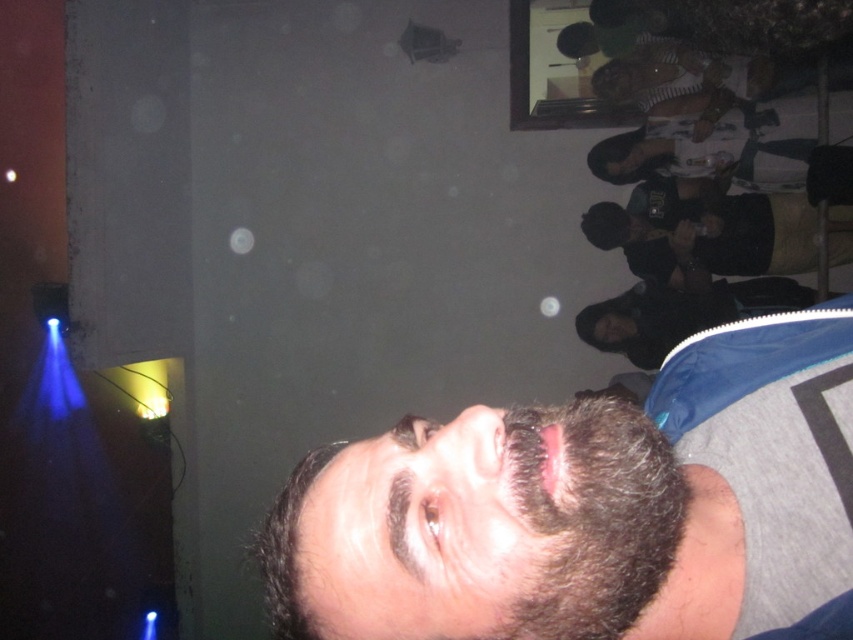
Does dark brown hair at center appear under black matte jacket at right?

Indeed, dark brown hair at center is positioned under black matte jacket at right.

Does dark brown hair at center have a larger size compared to black matte jacket at right?

No, dark brown hair at center is not bigger than black matte jacket at right.

Which is in front, point (677, 454) or point (630, 344)?

Positioned in front is point (677, 454).

Find the location of a particular element. This screenshot has width=853, height=640. dark brown hair at center is located at coordinates (589, 508).

Can you confirm if dark brown hair at center is positioned below dark blue shirt at right?

Indeed, dark brown hair at center is positioned under dark blue shirt at right.

Between point (390, 529) and point (759, 232), which one is positioned behind?

The point (759, 232) is behind.

Locate an element on the screen. The width and height of the screenshot is (853, 640). dark brown hair at center is located at coordinates (589, 508).

Looking at this image, who is positioned more to the right, dark brown hair at center or smooth skin face at upper right?

Positioned to the right is smooth skin face at upper right.

Does dark brown hair at center have a larger size compared to smooth skin face at upper right?

Yes, dark brown hair at center is bigger than smooth skin face at upper right.

Is point (641, 461) farther from viewer compared to point (611, 330)?

No, it is not.

Find the location of a particular element. dark brown hair at center is located at coordinates (589, 508).